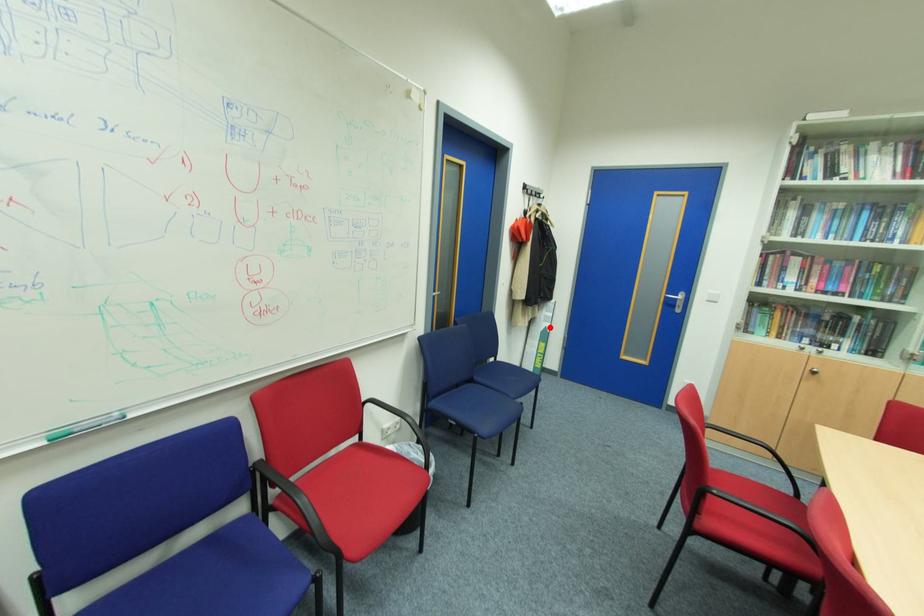
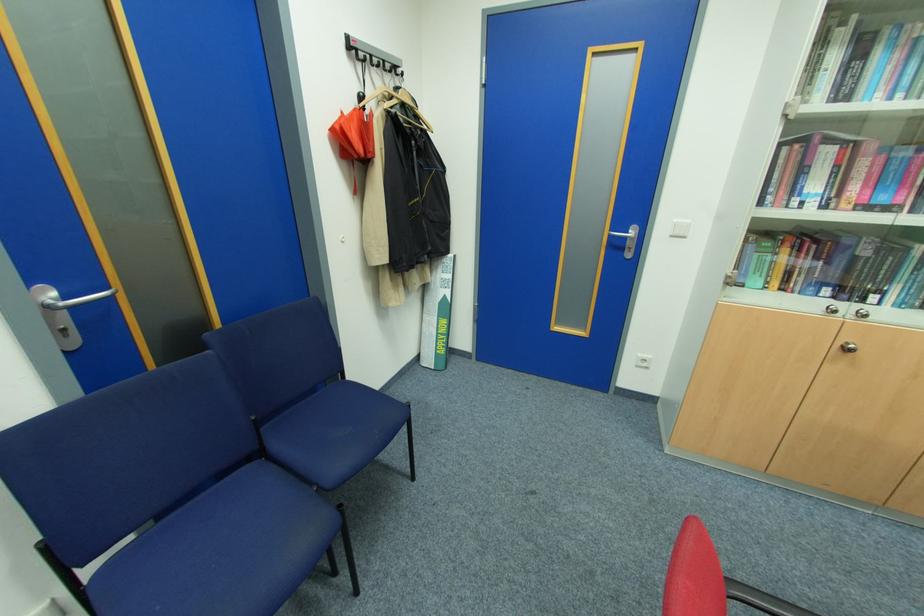
In the second image, find the point that corresponds to the highlighted location in the first image.

(448, 296)